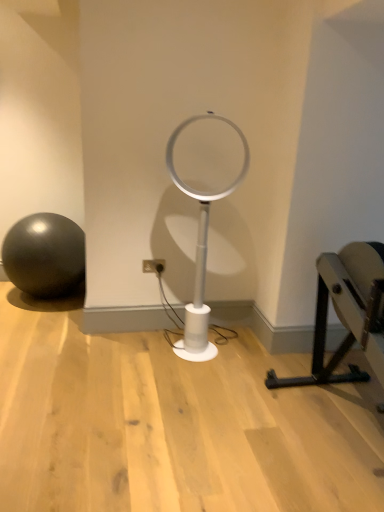
This screenshot has width=384, height=512. I want to click on white plastic electric outlet at center, so click(153, 266).

What is the approximate height of white plastic electric outlet at center?

It is 3.93 inches.

In order to face white plastic table lamp at center, should I rotate leftwards or rightwards?

Turn right approximately 1.735 degrees to face it.

The width and height of the screenshot is (384, 512). What do you see at coordinates (347, 312) in the screenshot?
I see `black metal bench at right` at bounding box center [347, 312].

Locate an element on the screen. The height and width of the screenshot is (512, 384). matte black ball at left is located at coordinates (45, 255).

At what (x,y) coordinates should I click in order to perform the action: click on white plastic electric outlet at center. Please return your answer as a coordinate pair (x, y). This screenshot has width=384, height=512. Looking at the image, I should click on (153, 266).

Who is shorter, black metal bench at right or matte black ball at left?

With less height is matte black ball at left.

In the image, is black metal bench at right positioned in front of or behind matte black ball at left?

Clearly, black metal bench at right is in front of matte black ball at left.

Which object is wider, black metal bench at right or matte black ball at left?

With larger width is black metal bench at right.

From the image's perspective, does black metal bench at right appear lower than matte black ball at left?

Correct, black metal bench at right appears lower than matte black ball at left in the image.

Looking at this image, in terms of height, does white plastic table lamp at center look taller or shorter compared to black metal bench at right?

Clearly, white plastic table lamp at center is taller compared to black metal bench at right.

Where is `table lamp behind the black metal bench at right`? Image resolution: width=384 pixels, height=512 pixels. table lamp behind the black metal bench at right is located at coordinates (201, 244).

Is white plastic table lamp at center in front of or behind black metal bench at right in the image?

white plastic table lamp at center is behind black metal bench at right.

From the image's perspective, who appears lower, white plastic table lamp at center or black metal bench at right?

black metal bench at right.

Is black metal bench at right wider or thinner than white plastic electric outlet at center?

Considering their sizes, black metal bench at right looks broader than white plastic electric outlet at center.

Is black metal bench at right bigger than white plastic electric outlet at center?

Yes, black metal bench at right is bigger than white plastic electric outlet at center.

Is point (351, 276) positioned after point (159, 272)?

No.

Can you tell me how much black metal bench at right and white plastic electric outlet at center differ in facing direction?

The angle between the facing direction of black metal bench at right and the facing direction of white plastic electric outlet at center is 90.2 degrees.

Can you confirm if white plastic electric outlet at center is smaller than matte black ball at left?

Indeed, white plastic electric outlet at center has a smaller size compared to matte black ball at left.

This screenshot has height=512, width=384. I want to click on electric outlet below the matte black ball at left (from the image's perspective), so click(153, 266).

Is white plastic electric outlet at center surrounding matte black ball at left?

Definitely not — matte black ball at left is not inside white plastic electric outlet at center.

Consider the image. Between white plastic electric outlet at center and matte black ball at left, which one has less height?

Standing shorter between the two is white plastic electric outlet at center.

Does matte black ball at left turn towards white plastic table lamp at center?

No, matte black ball at left does not turn towards white plastic table lamp at center.

Which is behind, matte black ball at left or white plastic table lamp at center?

matte black ball at left is further away from the camera.

Considering the relative sizes of matte black ball at left and white plastic table lamp at center in the image provided, is matte black ball at left thinner than white plastic table lamp at center?

In fact, matte black ball at left might be wider than white plastic table lamp at center.

Looking at this image, from the image's perspective, who appears lower, matte black ball at left or white plastic table lamp at center?

matte black ball at left.

Is white plastic electric outlet at center thinner than black metal bench at right?

Indeed, white plastic electric outlet at center has a lesser width compared to black metal bench at right.

From the picture: Is white plastic electric outlet at center bigger or smaller than black metal bench at right?

white plastic electric outlet at center is smaller than black metal bench at right.

Does white plastic electric outlet at center appear on the left side of black metal bench at right?

Indeed, white plastic electric outlet at center is positioned on the left side of black metal bench at right.

Is black metal bench at right surrounded by white plastic electric outlet at center?

No, black metal bench at right is not surrounded by white plastic electric outlet at center.

Which is less distant, (39,227) or (161,267)?

Point (161,267)

Consider the image. From the image's perspective, between matte black ball at left and white plastic electric outlet at center, which one is located above?

matte black ball at left appears higher in the image.

In the scene shown: Is there a large distance between matte black ball at left and white plastic electric outlet at center?

That's not correct — matte black ball at left is a little close to white plastic electric outlet at center.

Is matte black ball at left outside of white plastic electric outlet at center?

Yes, matte black ball at left is located beyond the bounds of white plastic electric outlet at center.

Locate an element on the screen. ball above the black metal bench at right (from the image's perspective) is located at coordinates (45, 255).

Locate an element on the screen. furniture in front of the white plastic table lamp at center is located at coordinates (347, 312).

Based on their spatial positions, is white plastic electric outlet at center or matte black ball at left closer to white plastic table lamp at center?

white plastic electric outlet at center.

From the image, which object appears to be farther from black metal bench at right, matte black ball at left or white plastic table lamp at center?

Among the two, matte black ball at left is located further to black metal bench at right.

Based on their spatial positions, is matte black ball at left or white plastic table lamp at center further from white plastic electric outlet at center?

matte black ball at left is further to white plastic electric outlet at center.

Estimate the real-world distances between objects in this image. Which object is further from black metal bench at right, white plastic electric outlet at center or white plastic table lamp at center?

The object further to black metal bench at right is white plastic electric outlet at center.

From the image, which object appears to be farther from matte black ball at left, white plastic table lamp at center or black metal bench at right?

Among the two, black metal bench at right is located further to matte black ball at left.

In the scene shown: Estimate the real-world distances between objects in this image. Which object is further from white plastic electric outlet at center, matte black ball at left or black metal bench at right?

Based on the image, black metal bench at right appears to be further to white plastic electric outlet at center.

Estimate the real-world distances between objects in this image. Which object is further from white plastic table lamp at center, matte black ball at left or white plastic electric outlet at center?

matte black ball at left.

Considering their positions, is white plastic table lamp at center positioned further to white plastic electric outlet at center than matte black ball at left?

matte black ball at left lies further to white plastic electric outlet at center than the other object.

At what (x,y) coordinates should I click in order to perform the action: click on electric outlet between matte black ball at left and white plastic table lamp at center in the horizontal direction. Please return your answer as a coordinate pair (x, y). This screenshot has width=384, height=512. Looking at the image, I should click on (153, 266).

The height and width of the screenshot is (512, 384). I want to click on electric outlet situated between matte black ball at left and black metal bench at right from left to right, so click(x=153, y=266).

You are a GUI agent. You are given a task and a screenshot of the screen. Output one action in this format:
    pyautogui.click(x=<x>, y=<y>)
    Task: Click on the table lamp between black metal bench at right and white plastic electric outlet at center along the z-axis
    The width and height of the screenshot is (384, 512).
    Given the screenshot: What is the action you would take?
    pyautogui.click(x=201, y=244)

Where is `table lamp situated between matte black ball at left and black metal bench at right from left to right`? table lamp situated between matte black ball at left and black metal bench at right from left to right is located at coordinates (201, 244).